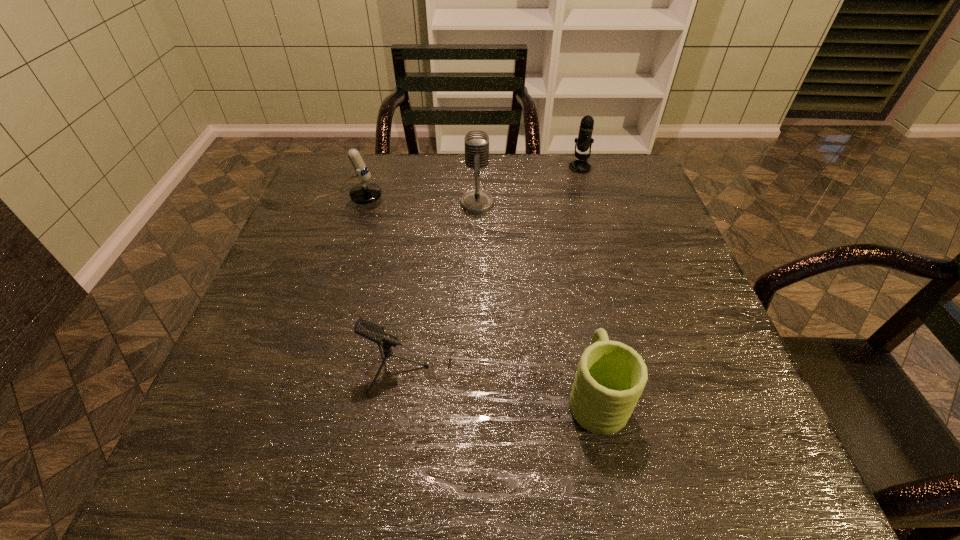
Find the location of a particular element. The height and width of the screenshot is (540, 960). the tallest microphone is located at coordinates (476, 142).

The image size is (960, 540). Identify the location of the farthest microphone. (584, 141).

Locate an element on the screen. This screenshot has height=540, width=960. the rightmost object is located at coordinates (584, 141).

Find the location of a particular element. The height and width of the screenshot is (540, 960). the leftmost microphone is located at coordinates (366, 192).

The width and height of the screenshot is (960, 540). What are the coordinates of `the nearest microphone` in the screenshot? It's located at (369, 330).

Find the location of a particular element. The height and width of the screenshot is (540, 960). mug is located at coordinates (611, 376).

Locate an element on the screen. This screenshot has width=960, height=540. vacant region located 0.210m on the left of the tallest object is located at coordinates (383, 202).

Image resolution: width=960 pixels, height=540 pixels. What are the coordinates of `free space located 0.240m on the front of the rightmost object` in the screenshot? It's located at (596, 226).

I want to click on blank space located on the right of the leftmost object, so click(x=405, y=201).

Locate an element on the screen. free space located 0.260m on the stand of the nearest microphone is located at coordinates (x=618, y=369).